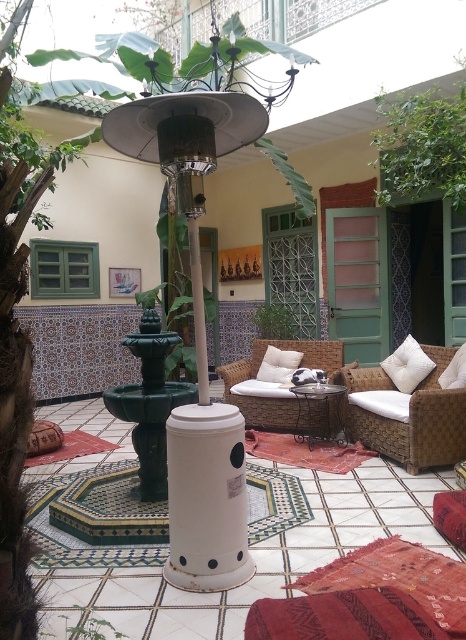
You are standing at the camera position and want to move towards the woven rattan armchair at center. Is the distance more than 4 meters?

The distance between the woven rattan armchair at center and the camera is 4.01 meters, which is just over 4 meters. Therefore, yes, the distance is more than 4 meters.

You are standing at the point marked as point (437,460) in a Moroccan patio. You want to take a photo of the entire area. If your camera has a maximum focus range of 4 meters, will it be able to capture the entire scene clearly?

The distance between point (437,460) and the camera is exactly 4.09 meters. Since the camera can only focus up to 4 meters, it will not be able to capture the entire scene clearly as the distance exceeds the maximum focus range.